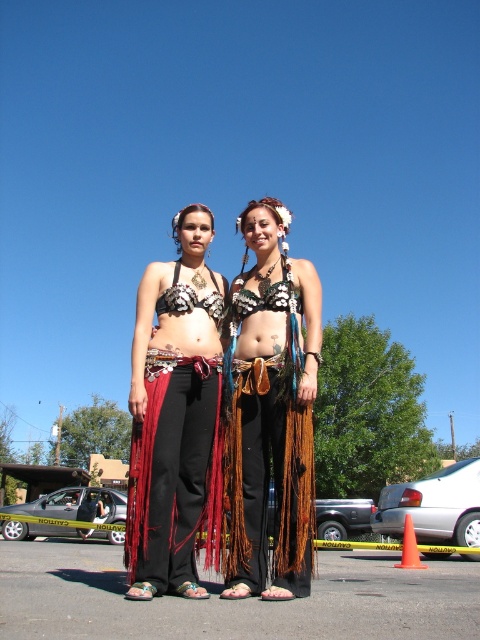
Where is `leather fringe skirt at center`? Image resolution: width=480 pixels, height=640 pixels. leather fringe skirt at center is located at coordinates (272, 410).

Does leather fringe skirt at center have a lesser height compared to matte black bikini top at center?

In fact, leather fringe skirt at center may be taller than matte black bikini top at center.

Is point (228, 472) farther from camera compared to point (181, 298)?

No, it is in front of (181, 298).

Where is `leather fringe skirt at center`? This screenshot has width=480, height=640. leather fringe skirt at center is located at coordinates (272, 410).

Between leather fringe skirt at center and brown leather belt at center, which one appears on the left side from the viewer's perspective?

brown leather belt at center is more to the left.

Does leather fringe skirt at center appear on the right side of brown leather belt at center?

Yes, leather fringe skirt at center is to the right of brown leather belt at center.

You are a GUI agent. You are given a task and a screenshot of the screen. Output one action in this format:
    pyautogui.click(x=<x>, y=<y>)
    Task: Click on the leather fringe skirt at center
    
    Given the screenshot: What is the action you would take?
    pyautogui.click(x=272, y=410)

This screenshot has height=640, width=480. Identify the location of leather fringe skirt at center. (272, 410).

Who is lower down, black leather sandals at center or metallic silver bikini top at center?

Positioned lower is black leather sandals at center.

The height and width of the screenshot is (640, 480). What are the coordinates of `black leather sandals at center` in the screenshot? It's located at [231, 602].

I want to click on black leather sandals at center, so click(231, 602).

Find the location of `black leather sandals at center`. black leather sandals at center is located at coordinates (231, 602).